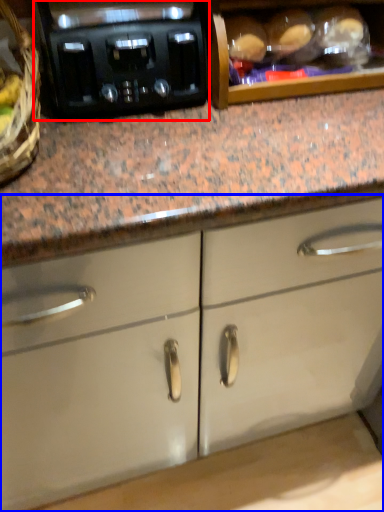
Question: Among these objects, which one is farthest to the camera, home appliance (highlighted by a red box) or cabinetry (highlighted by a blue box)?

Choices:
 (A) home appliance
 (B) cabinetry

Answer: (B)